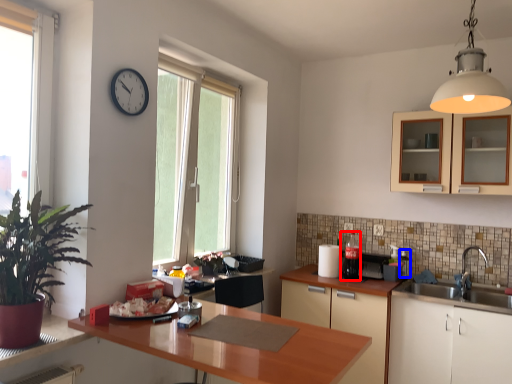
Question: Which object appears closest to the camera in this image, appliance (highlighted by a red box) or appliance (highlighted by a blue box)?

Choices:
 (A) appliance
 (B) appliance

Answer: (A)